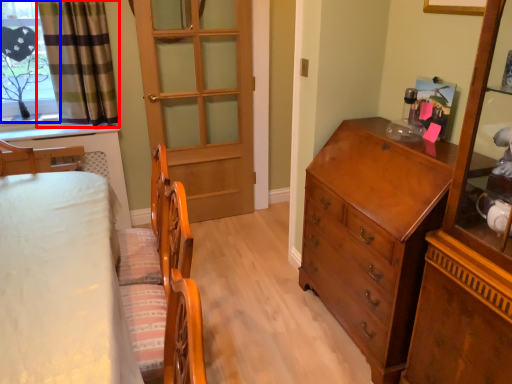
Question: Among these objects, which one is nearest to the camera, curtain (highlighted by a red box) or window (highlighted by a blue box)?

Choices:
 (A) curtain
 (B) window

Answer: (A)